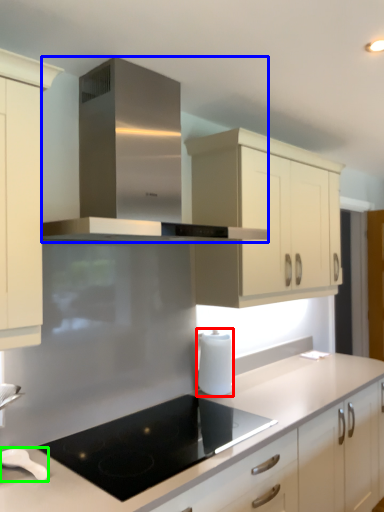
Question: Based on their relative distances, which object is nearer to kitchen appliance (highlighted by a red box)? Choose from home appliance (highlighted by a blue box) and kitchen appliance (highlighted by a green box).

Choices:
 (A) home appliance
 (B) kitchen appliance

Answer: (B)